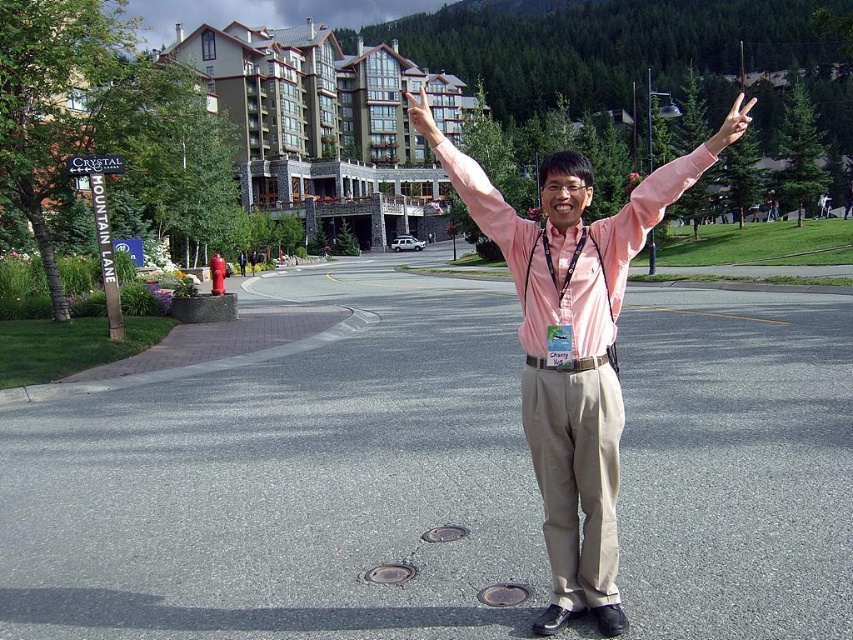
The width and height of the screenshot is (853, 640). What do you see at coordinates (572, 356) in the screenshot?
I see `pink fabric shirt at center` at bounding box center [572, 356].

Consider the image. Who is lower down, pink fabric shirt at center or pink fabric hand at center?

Positioned lower is pink fabric shirt at center.

What do you see at coordinates (572, 356) in the screenshot? I see `pink fabric shirt at center` at bounding box center [572, 356].

The width and height of the screenshot is (853, 640). What are the coordinates of `pink fabric shirt at center` in the screenshot? It's located at (572, 356).

Is brown stone building at upper center to the right of khaki cotton pants at center from the viewer's perspective?

In fact, brown stone building at upper center is to the left of khaki cotton pants at center.

Which is in front, point (358, 88) or point (570, 371)?

Point (570, 371) is more forward.

In the scene shown: Who is more distant from viewer, (219, 36) or (566, 552)?

Point (219, 36)

The height and width of the screenshot is (640, 853). Identify the location of brown stone building at upper center. (323, 122).

Is khaki cotton pants at center smaller than pink fabric arm at center?

Yes.

Is khaki cotton pants at center behind pink fabric arm at center?

No, it is not.

Which is behind, point (616, 397) or point (497, 136)?

The point (497, 136) is more distant.

You are a GUI agent. You are given a task and a screenshot of the screen. Output one action in this format:
    pyautogui.click(x=<x>, y=<y>)
    Task: Click on the khaki cotton pants at center
    This screenshot has height=640, width=853.
    Given the screenshot: What is the action you would take?
    pyautogui.click(x=576, y=476)